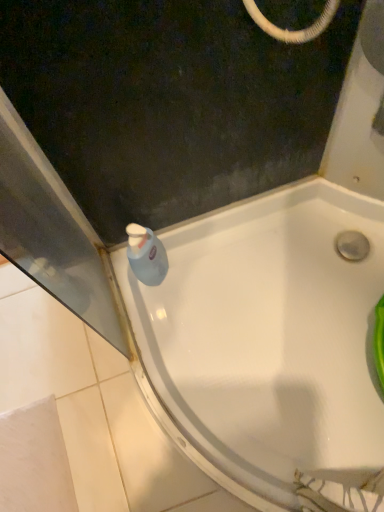
Locate an element on the screen. This screenshot has width=384, height=512. vacant space situated above white glossy bathtub at upper center (from a real-world perspective) is located at coordinates (79, 413).